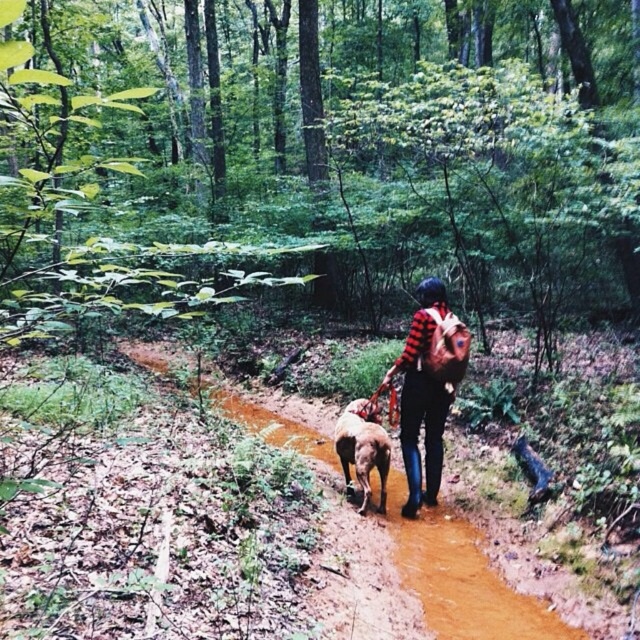
You are a hiker who wants to stay on the brown dirt trail at center while walking your brown furry dog at center. Based on their positions, which direction should you walk to keep the dog on the trail?

The brown dirt trail at center is to the right of the brown furry dog at center, so you should walk the dog to the right to keep them on the trail.

You are the person in the image walking along the brown dirt trail at center and wearing the plaid shirt at center. If you look down, which object is closer to your eyes?

The brown dirt trail at center is closer to your eyes because it is in front of the plaid shirt at center.